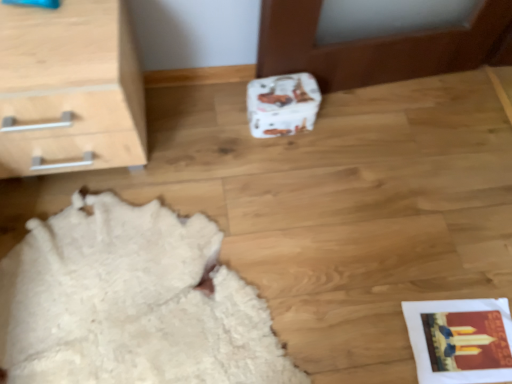
Question: From a real-world perspective, is white paper shoe box at center physically located above or below white fluffy rug at lower left?

Choices:
 (A) below
 (B) above

Answer: (B)

Question: Is white paper shoe box at center taller or shorter than white fluffy rug at lower left?

Choices:
 (A) tall
 (B) short

Answer: (A)

Question: Estimate the real-world distances between objects in this image. Which object is farther from the white fluffy rug at lower left?

Choices:
 (A) light wood/texture chest of drawers at upper left
 (B) white paper shoe box at center

Answer: (B)

Question: Estimate the real-world distances between objects in this image. Which object is farther from the white fluffy rug at lower left?

Choices:
 (A) white paper shoe box at center
 (B) light wood/texture chest of drawers at upper left

Answer: (A)